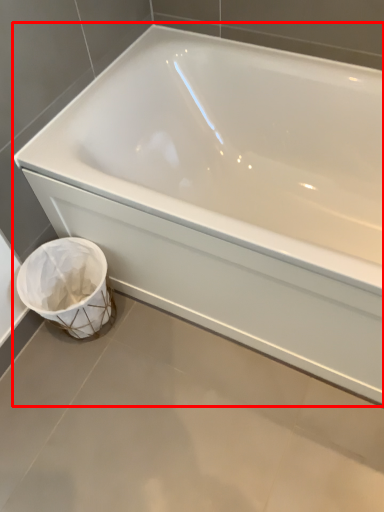
Question: Observing the image, what is the correct spatial positioning of bathtub (annotated by the red box) in reference to toilet bowl?

Choices:
 (A) left
 (B) right

Answer: (B)